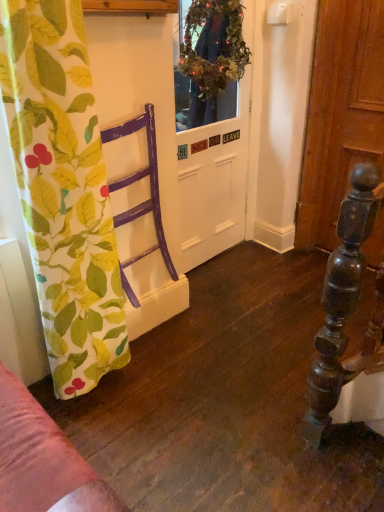
Question: From a real-world perspective, is purple wood chair at left physically located above or below white matte door at center?

Choices:
 (A) above
 (B) below

Answer: (B)

Question: Visually, is purple wood chair at left positioned to the left or to the right of white matte door at center?

Choices:
 (A) left
 (B) right

Answer: (A)

Question: Considering the real-world distances, which object is farthest from the printed fabric curtain at left?

Choices:
 (A) green leafy wreath at upper center
 (B) purple wood chair at left
 (C) white matte door at center

Answer: (A)

Question: Estimate the real-world distances between objects in this image. Which object is closer to the printed fabric curtain at left?

Choices:
 (A) white matte door at center
 (B) green leafy wreath at upper center
 (C) purple wood chair at left

Answer: (C)